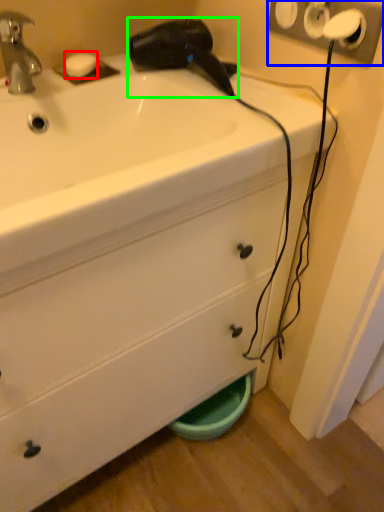
Question: Estimate the real-world distances between objects in this image. Which object is closer to soap (highlighted by a red box), electric outlet (highlighted by a blue box) or hair drier (highlighted by a green box)?

Choices:
 (A) electric outlet
 (B) hair drier

Answer: (B)